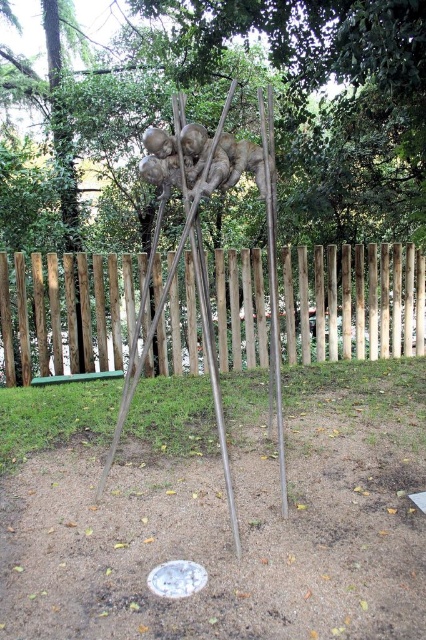
What object is located at the coordinates point (x=216, y=508) in the image?

The point (x=216, y=508) indicates the location of the brushed metal tripod at center.

Looking at this image, you are standing in the sculpture garden and want to take a photo of the brushed metal sculpture at center and the wooden fence at center. Which object is closer to you, the photographer?

The brushed metal sculpture at center is closer to you than the wooden fence at center.